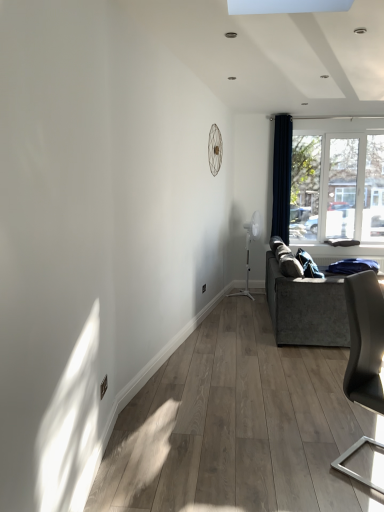
Question: Is white plastic window at right next to navy blue velvet curtain at right?

Choices:
 (A) yes
 (B) no

Answer: (B)

Question: Considering the relative positions of white plastic window at right and navy blue velvet curtain at right in the image provided, is white plastic window at right behind navy blue velvet curtain at right?

Choices:
 (A) no
 (B) yes

Answer: (B)

Question: Is white plastic window at right taller than navy blue velvet curtain at right?

Choices:
 (A) yes
 (B) no

Answer: (B)

Question: Would you say navy blue velvet curtain at right is part of white plastic window at right's contents?

Choices:
 (A) no
 (B) yes

Answer: (A)

Question: From the image's perspective, does white plastic window at right appear higher than navy blue velvet curtain at right?

Choices:
 (A) yes
 (B) no

Answer: (B)

Question: From a real-world perspective, is white plastic window at right positioned under navy blue velvet curtain at right based on gravity?

Choices:
 (A) no
 (B) yes

Answer: (B)

Question: Does white plastic window at right appear on the left side of velvet grey couch at right?

Choices:
 (A) no
 (B) yes

Answer: (A)

Question: Is velvet grey couch at right completely or partially inside white plastic window at right?

Choices:
 (A) no
 (B) yes

Answer: (A)

Question: Is the depth of white plastic window at right greater than that of velvet grey couch at right?

Choices:
 (A) no
 (B) yes

Answer: (B)

Question: Considering the relative sizes of white plastic window at right and velvet grey couch at right in the image provided, is white plastic window at right thinner than velvet grey couch at right?

Choices:
 (A) no
 (B) yes

Answer: (B)

Question: Is white plastic window at right closer to the viewer compared to velvet grey couch at right?

Choices:
 (A) no
 (B) yes

Answer: (A)

Question: Does white plastic window at right appear on the right side of velvet grey couch at right?

Choices:
 (A) yes
 (B) no

Answer: (A)

Question: Can you confirm if matte gray chair at right is thinner than navy blue velvet curtain at right?

Choices:
 (A) yes
 (B) no

Answer: (B)